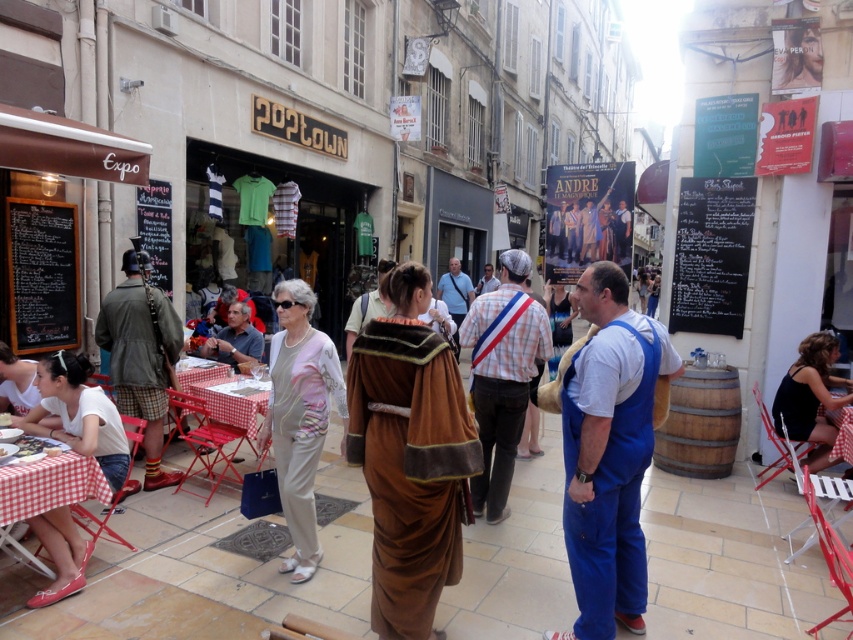
Question: Is light beige fabric pants at center in front of black fabric dress at lower right?

Choices:
 (A) no
 (B) yes

Answer: (B)

Question: Which of these objects is positioned farthest from the green plaid shorts at left?

Choices:
 (A) matte brown leather jacket at center
 (B) black chalkboard menu at left

Answer: (A)

Question: Which object is positioned closest to the light beige fabric pants at center?

Choices:
 (A) black fabric dress at lower right
 (B) blue cotton overalls at center

Answer: (B)

Question: Does blue cotton overalls at center appear over black chalkboard menu at left?

Choices:
 (A) yes
 (B) no

Answer: (B)

Question: Which point is closer to the camera?

Choices:
 (A) 798,384
 (B) 44,540
 (C) 294,413
 (D) 26,268

Answer: (B)

Question: Can you confirm if black chalkboard menu at left is positioned to the left of matte brown leather jacket at center?

Choices:
 (A) yes
 (B) no

Answer: (A)